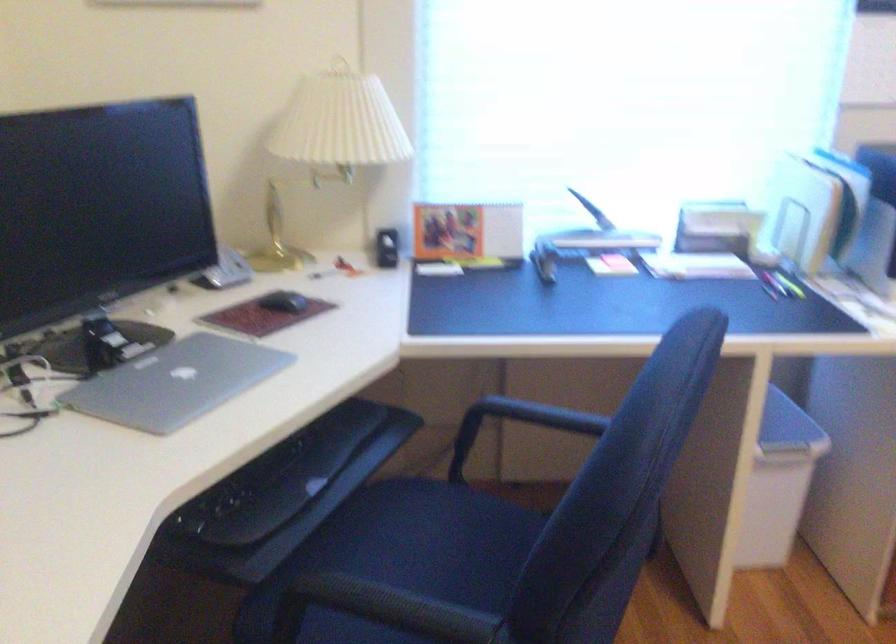
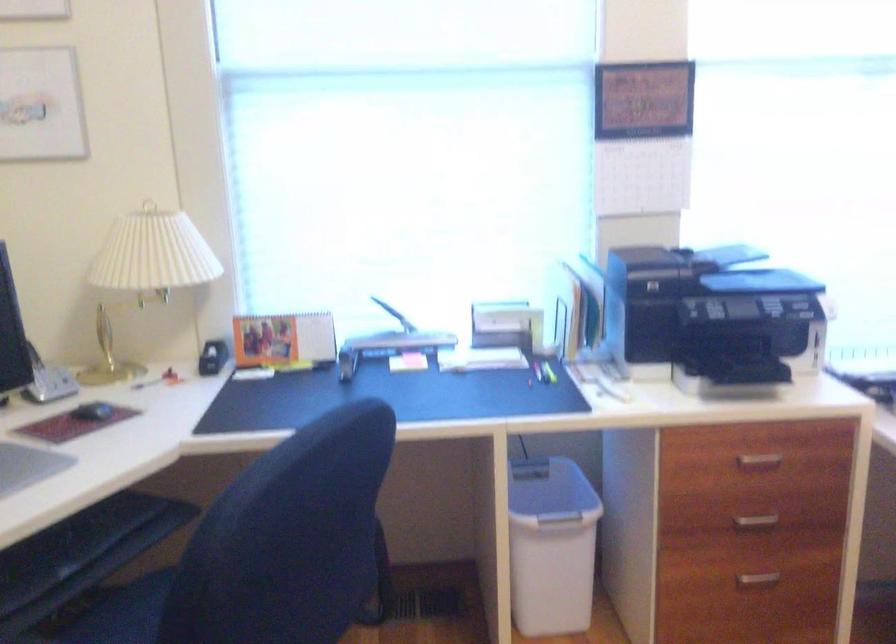
Question: The images are taken continuously from a first-person perspective. In which direction is your viewpoint rotating?

Choices:
 (A) Left
 (B) Right
 (C) Up
 (D) Down

Answer: (C)